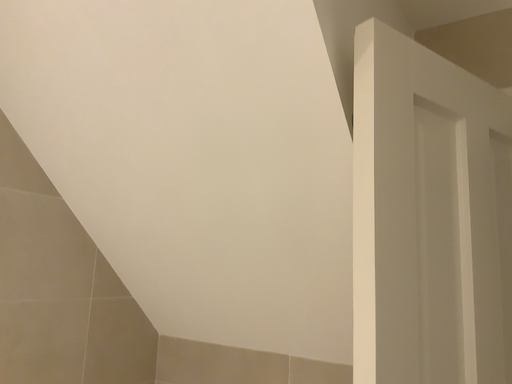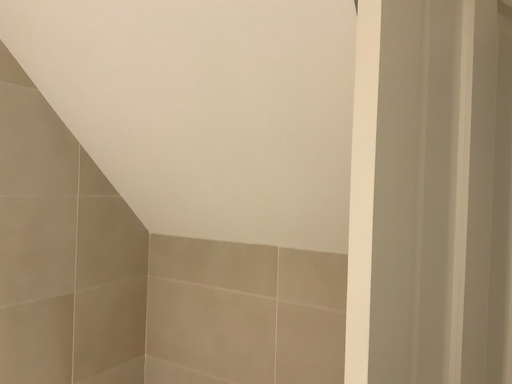
Question: How did the camera likely rotate when shooting the video?

Choices:
 (A) rotated downward
 (B) rotated upward

Answer: (A)